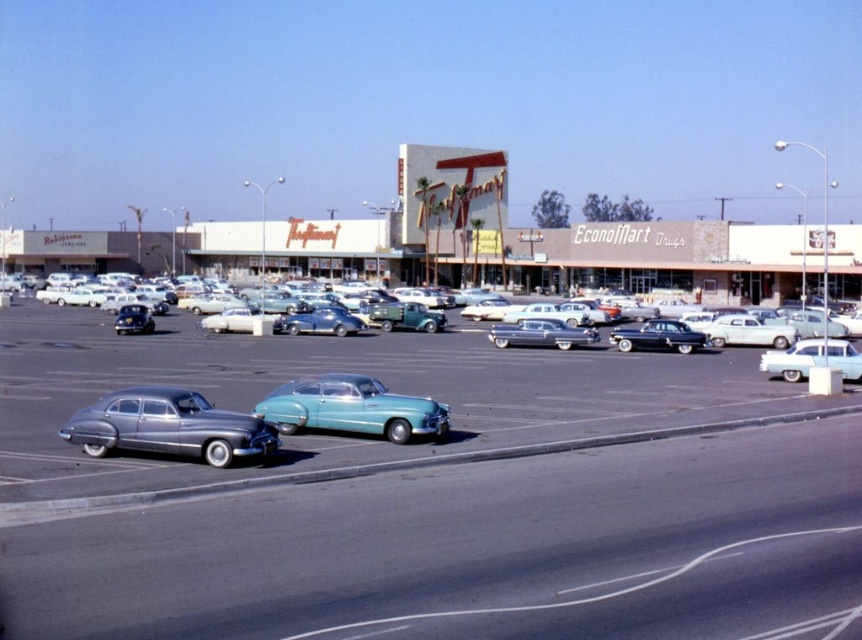
You are standing at the entrance of the vintage shopping center and see the point marked at coordinates (431, 497). What object is located at this point?

The point at coordinates (431, 497) marks the teal glossy car at center.